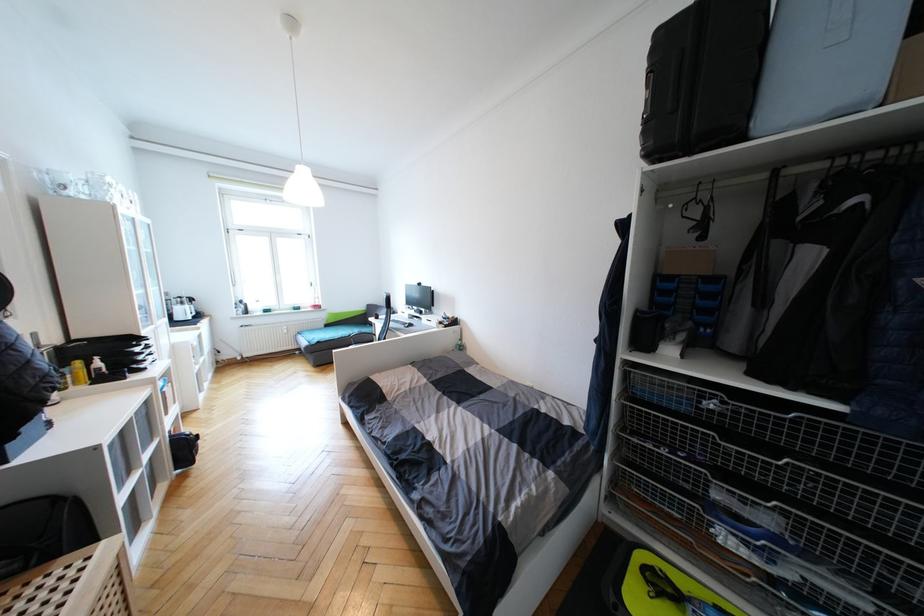
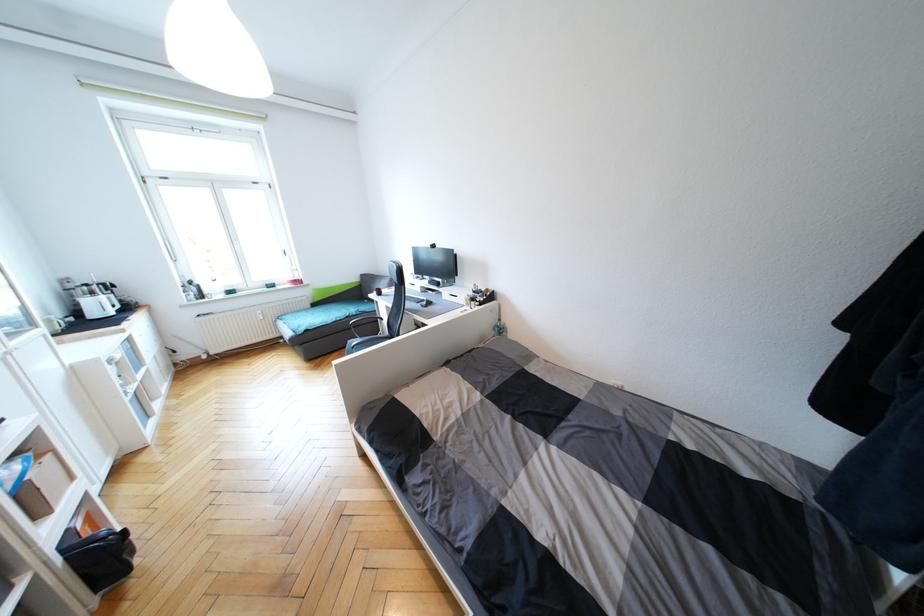
Where in the second image is the point corresponding to (331,326) from the first image?

(319, 306)